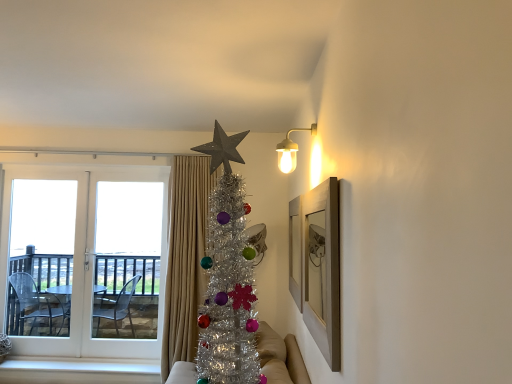
Question: Is wooden picture frame at upper right to the left of white glass door at left from the viewer's perspective?

Choices:
 (A) no
 (B) yes

Answer: (A)

Question: Is wooden picture frame at upper right facing towards white glass door at left?

Choices:
 (A) no
 (B) yes

Answer: (A)

Question: Does wooden picture frame at upper right appear on the right side of white glass door at left?

Choices:
 (A) yes
 (B) no

Answer: (A)

Question: Is wooden picture frame at upper right not within white glass door at left?

Choices:
 (A) no
 (B) yes

Answer: (B)

Question: Considering the relative sizes of wooden picture frame at upper right and white glass door at left in the image provided, is wooden picture frame at upper right taller than white glass door at left?

Choices:
 (A) no
 (B) yes

Answer: (A)

Question: From the image's perspective, relative to wooden picture frame at upper right, is white glass door at left above or below?

Choices:
 (A) above
 (B) below

Answer: (B)

Question: Is white glass door at left in front of or behind wooden picture frame at upper right in the image?

Choices:
 (A) behind
 (B) front

Answer: (A)

Question: Does point (x=54, y=317) appear closer or farther from the camera than point (x=314, y=253)?

Choices:
 (A) farther
 (B) closer

Answer: (A)

Question: From a real-world perspective, is white glass door at left positioned above or below wooden picture frame at upper right?

Choices:
 (A) above
 (B) below

Answer: (B)

Question: Do you think wooden picture frame at upper right is within white glass door at left, or outside of it?

Choices:
 (A) inside
 (B) outside

Answer: (B)

Question: In terms of width, does wooden picture frame at upper right look wider or thinner when compared to white glass door at left?

Choices:
 (A) wide
 (B) thin

Answer: (B)

Question: Is wooden picture frame at upper right in front of or behind white glass door at left in the image?

Choices:
 (A) front
 (B) behind

Answer: (A)

Question: From their relative heights in the image, would you say wooden picture frame at upper right is taller or shorter than white glass door at left?

Choices:
 (A) tall
 (B) short

Answer: (B)

Question: In the image, is wooden picture frame at upper right positioned in front of or behind transparent plastic screen door at left, placed as the first screen door when sorted from left to right?

Choices:
 (A) front
 (B) behind

Answer: (A)

Question: Is wooden picture frame at upper right wider or thinner than transparent plastic screen door at left, the 2th screen door when ordered from right to left?

Choices:
 (A) thin
 (B) wide

Answer: (A)